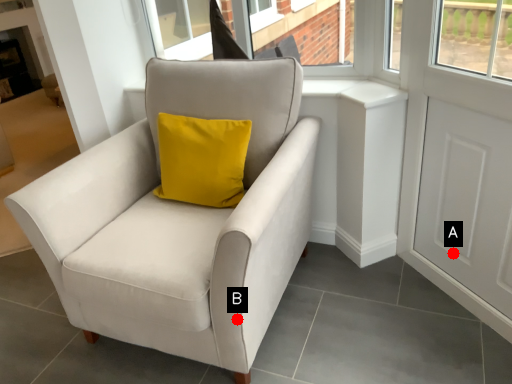
Question: Two points are circled on the image, labeled by A and B beside each circle. Among these points, which one is nearest to the camera?

Choices:
 (A) A is closer
 (B) B is closer

Answer: (B)